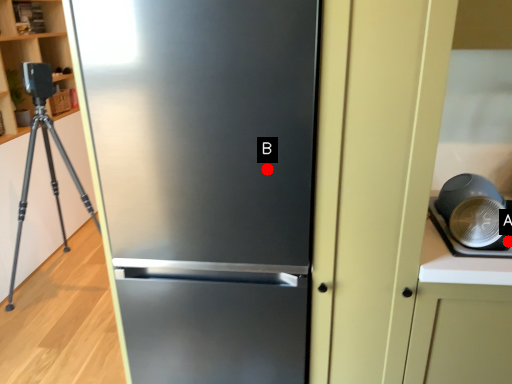
Question: Two points are circled on the image, labeled by A and B beside each circle. Which point is farther to the camera?

Choices:
 (A) A is further
 (B) B is further

Answer: (A)